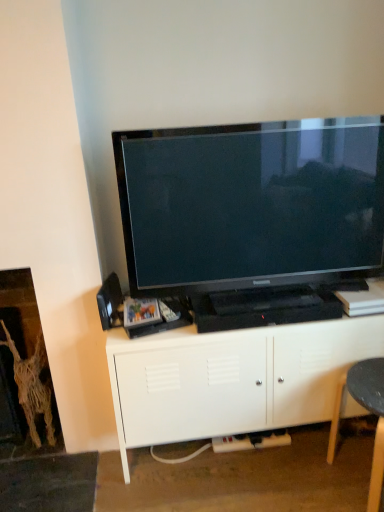
The image size is (384, 512). Identify the location of free spot above black plastic swivel chair at lower right (from a real-world perspective). (368, 375).